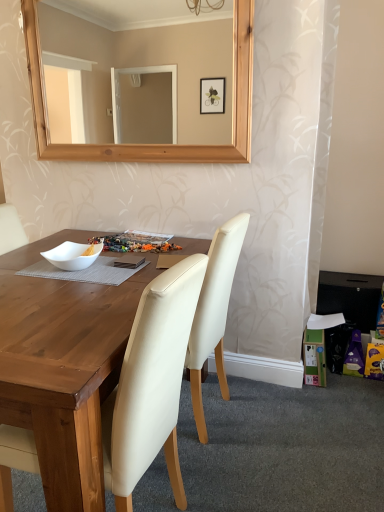
Question: Considering the relative sizes of cream leather chair at center, the first chair viewed from the back, and white matte bowl at center in the image provided, is cream leather chair at center, the first chair viewed from the back, taller than white matte bowl at center?

Choices:
 (A) yes
 (B) no

Answer: (A)

Question: Does cream leather chair at center, the first chair viewed from the back, have a smaller size compared to white matte bowl at center?

Choices:
 (A) no
 (B) yes

Answer: (A)

Question: Does cream leather chair at center, the second chair viewed from the front, turn towards white matte bowl at center?

Choices:
 (A) yes
 (B) no

Answer: (B)

Question: Can you confirm if cream leather chair at center, the first chair viewed from the back, is positioned to the left of white matte bowl at center?

Choices:
 (A) no
 (B) yes

Answer: (A)

Question: Considering the relative sizes of cream leather chair at center, the second chair viewed from the front, and white matte bowl at center in the image provided, is cream leather chair at center, the second chair viewed from the front, shorter than white matte bowl at center?

Choices:
 (A) no
 (B) yes

Answer: (A)

Question: Is white matte bowl at center situated inside cream leather chair at center, the first chair viewed from the back, or outside?

Choices:
 (A) outside
 (B) inside

Answer: (A)

Question: In terms of width, does white matte bowl at center look wider or thinner when compared to cream leather chair at center, the first chair viewed from the back?

Choices:
 (A) wide
 (B) thin

Answer: (B)

Question: From a real-world perspective, is white matte bowl at center physically located above or below cream leather chair at center, the second chair viewed from the front?

Choices:
 (A) below
 (B) above

Answer: (B)

Question: In the image, is white matte bowl at center on the left side or the right side of cream leather chair at center, the first chair viewed from the back?

Choices:
 (A) right
 (B) left

Answer: (B)

Question: Relative to cream leather chair at center, which is counted as the first chair, starting from the front, is white matte bowl at center in front or behind?

Choices:
 (A) front
 (B) behind

Answer: (B)

Question: From a real-world perspective, is white matte bowl at center physically located above or below cream leather chair at center, which is counted as the first chair, starting from the front?

Choices:
 (A) above
 (B) below

Answer: (A)

Question: Is white matte bowl at center to the left or to the right of cream leather chair at center, arranged as the 2th chair when viewed from the back, in the image?

Choices:
 (A) left
 (B) right

Answer: (A)

Question: Would you say white matte bowl at center is inside or outside cream leather chair at center, arranged as the 2th chair when viewed from the back?

Choices:
 (A) outside
 (B) inside

Answer: (A)

Question: From the image's perspective, relative to cream leather chair at center, the second chair viewed from the front, is cream leather chair at center, which is counted as the first chair, starting from the front, above or below?

Choices:
 (A) below
 (B) above

Answer: (A)

Question: In the image, is cream leather chair at center, arranged as the 2th chair when viewed from the back, on the left side or the right side of cream leather chair at center, the second chair viewed from the front?

Choices:
 (A) right
 (B) left

Answer: (B)